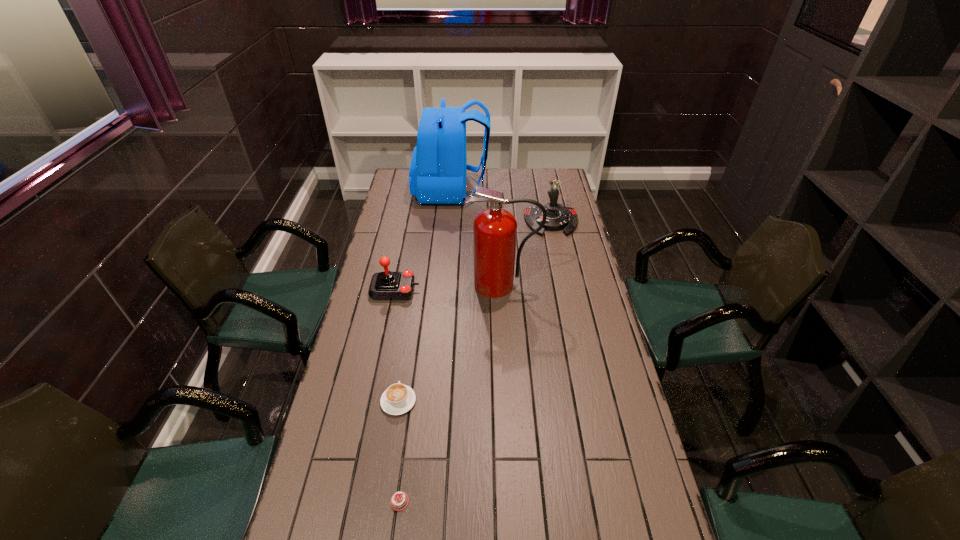
In order to click on backpack in this screenshot , I will do `click(437, 175)`.

Identify the location of fire extinguisher. The width and height of the screenshot is (960, 540). (494, 229).

Identify the location of the fourth shortest object. The height and width of the screenshot is (540, 960). (559, 217).

Where is `the taller joystick`? This screenshot has height=540, width=960. the taller joystick is located at coordinates (559, 217).

This screenshot has width=960, height=540. In order to click on the third shortest object in this screenshot , I will do `click(387, 285)`.

Identify the location of the shorter joystick. The height and width of the screenshot is (540, 960). (387, 285).

Where is `the fifth farthest object`? the fifth farthest object is located at coordinates (397, 399).

Find the location of `the fifth tallest object`. the fifth tallest object is located at coordinates (397, 399).

This screenshot has width=960, height=540. What are the coordinates of `the shortest object` in the screenshot? It's located at (399, 501).

What are the coordinates of `chocolate cake` in the screenshot? It's located at (399, 501).